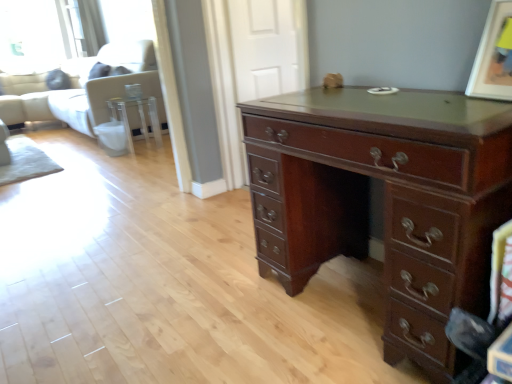
This screenshot has width=512, height=384. Describe the element at coordinates (494, 56) in the screenshot. I see `matte brown picture frame at upper right` at that location.

The width and height of the screenshot is (512, 384). What do you see at coordinates (385, 200) in the screenshot? I see `mahogany wood desk at center` at bounding box center [385, 200].

Where is `matte brown picture frame at upper right`? The width and height of the screenshot is (512, 384). matte brown picture frame at upper right is located at coordinates (494, 56).

From a real-world perspective, is white fabric couch at upper left physically above mahogany wood desk at center?

Yes, from a real-world perspective, white fabric couch at upper left is above mahogany wood desk at center.

Is white fabric couch at upper left facing away from mahogany wood desk at center?

No, white fabric couch at upper left is not facing away from mahogany wood desk at center.

Which of these two, white fabric couch at upper left or mahogany wood desk at center, is smaller?

mahogany wood desk at center.

Measure the distance from white fabric couch at upper left to mahogany wood desk at center.

white fabric couch at upper left is 3.51 meters away from mahogany wood desk at center.

From the image's perspective, which object appears higher, mahogany wood desk at center or white fabric couch at upper left?

white fabric couch at upper left.

Does point (282, 178) come in front of point (124, 76)?

Yes.

Considering the positions of objects mahogany wood desk at center and white fabric couch at upper left in the image provided, who is in front, mahogany wood desk at center or white fabric couch at upper left?

Positioned in front is mahogany wood desk at center.

Would you say mahogany wood desk at center is a long distance from white fabric couch at upper left?

Yes, mahogany wood desk at center is far from white fabric couch at upper left.

Is point (18, 113) closer or farther from the camera than point (110, 102)?

Point (18, 113).

Which object is positioned more to the left, white fabric couch at upper left or clear glass side table at center?

From the viewer's perspective, white fabric couch at upper left appears more on the left side.

Between white fabric couch at upper left and clear glass side table at center, which one has more height?

Standing taller between the two is white fabric couch at upper left.

Which object is thinner, white fabric couch at upper left or clear glass side table at center?

clear glass side table at center.

From a real-world perspective, between clear glass side table at center and mahogany wood desk at center, who is vertically higher?

mahogany wood desk at center is physically above.

How much distance is there between clear glass side table at center and mahogany wood desk at center?

clear glass side table at center is 3.39 meters from mahogany wood desk at center.

Which object is wider, clear glass side table at center or mahogany wood desk at center?

Wider between the two is mahogany wood desk at center.

Which of these two, clear glass side table at center or mahogany wood desk at center, is bigger?

With larger size is mahogany wood desk at center.

Measure the distance from matte brown picture frame at upper right to mahogany wood desk at center.

18.41 inches.

Does point (511, 26) come in front of point (456, 238)?

No, it is not.

Is matte brown picture frame at upper right wider than mahogany wood desk at center?

No, matte brown picture frame at upper right is not wider than mahogany wood desk at center.

How distant is clear glass side table at center from white fabric couch at upper left?

The distance of clear glass side table at center from white fabric couch at upper left is 20.62 centimeters.

Considering the positions of objects clear glass side table at center and white fabric couch at upper left in the image provided, who is behind, clear glass side table at center or white fabric couch at upper left?

Positioned behind is white fabric couch at upper left.

Is clear glass side table at center to the right of white fabric couch at upper left from the viewer's perspective?

Yes, clear glass side table at center is to the right of white fabric couch at upper left.

From a real-world perspective, is clear glass side table at center positioned above or below white fabric couch at upper left?

From a real-world perspective, clear glass side table at center is physically below white fabric couch at upper left.

Is point (113, 102) behind point (475, 92)?

Yes.

Is clear glass side table at center spatially inside matte brown picture frame at upper right, or outside of it?

clear glass side table at center exists outside the volume of matte brown picture frame at upper right.

Considering the relative sizes of clear glass side table at center and matte brown picture frame at upper right in the image provided, is clear glass side table at center smaller than matte brown picture frame at upper right?

No, clear glass side table at center is not smaller than matte brown picture frame at upper right.

Locate an element on the screen. The image size is (512, 384). couch on the left of mahogany wood desk at center is located at coordinates (120, 89).

The image size is (512, 384). I want to click on couch above the mahogany wood desk at center (from a real-world perspective), so click(120, 89).

From the image, which object appears to be farther from white fabric couch at upper left, clear glass side table at center or mahogany wood desk at center?

mahogany wood desk at center is further to white fabric couch at upper left.

When comparing their distances from matte brown picture frame at upper right, does clear glass side table at center or white fabric couch at upper left seem further?

white fabric couch at upper left.

Considering their positions, is clear glass side table at center positioned closer to mahogany wood desk at center than white fabric couch at upper left?

Based on the image, clear glass side table at center appears to be nearer to mahogany wood desk at center.

Looking at the image, which one is located closer to clear glass side table at center, mahogany wood desk at center or white fabric couch at upper left?

white fabric couch at upper left is positioned closer to the anchor clear glass side table at center.

Looking at the image, which one is located further to white fabric couch at upper left, matte brown picture frame at upper right or clear glass side table at center?

matte brown picture frame at upper right is further to white fabric couch at upper left.

Which object lies further to the anchor point mahogany wood desk at center, matte brown picture frame at upper right or white fabric couch at upper left?

white fabric couch at upper left is positioned further to the anchor mahogany wood desk at center.

Based on their spatial positions, is matte brown picture frame at upper right or white fabric couch at upper left closer to clear glass side table at center?

white fabric couch at upper left is positioned closer to the anchor clear glass side table at center.

Looking at the image, which one is located further to mahogany wood desk at center, clear glass side table at center or matte brown picture frame at upper right?

clear glass side table at center is further to mahogany wood desk at center.

Image resolution: width=512 pixels, height=384 pixels. What are the coordinates of `picture frame between mahogany wood desk at center and white fabric couch at upper left in the front-back direction` in the screenshot? It's located at (494, 56).

The height and width of the screenshot is (384, 512). I want to click on picture frame between mahogany wood desk at center and clear glass side table at center along the z-axis, so click(x=494, y=56).

The width and height of the screenshot is (512, 384). I want to click on side table located between mahogany wood desk at center and white fabric couch at upper left in the depth direction, so click(140, 117).

Find the location of `side table between matte brown picture frame at upper right and white fabric couch at upper left from front to back`. side table between matte brown picture frame at upper right and white fabric couch at upper left from front to back is located at coordinates (140, 117).